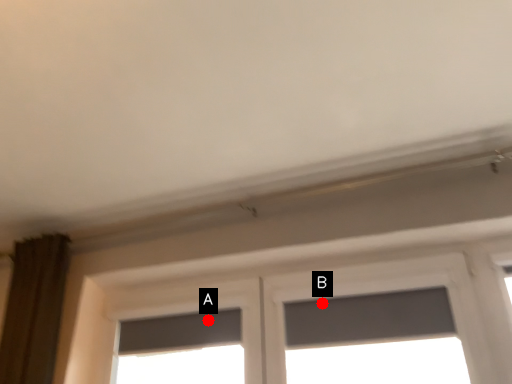
Question: Two points are circled on the image, labeled by A and B beside each circle. Which point is farther to the camera?

Choices:
 (A) A is further
 (B) B is further

Answer: (A)